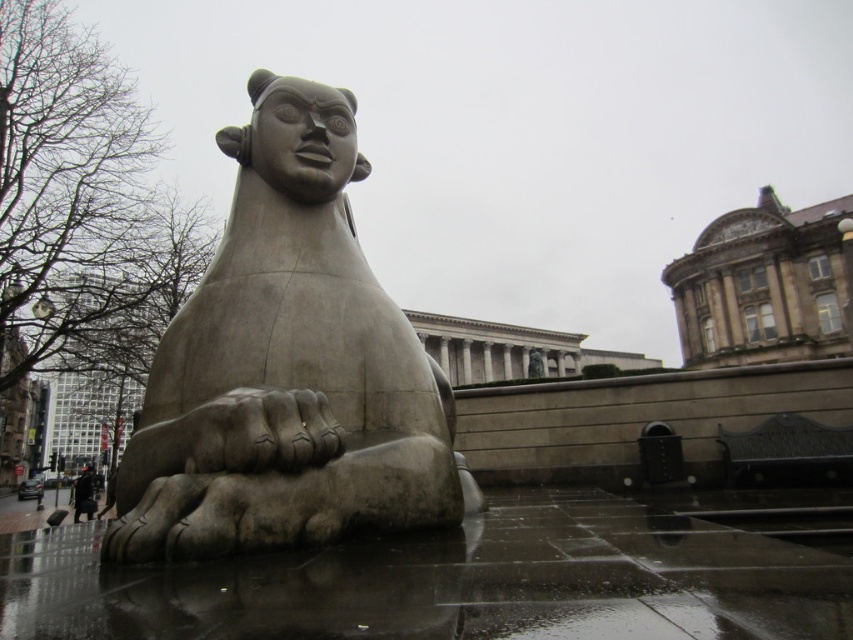
Question: Can you confirm if gray stone sculpture at center is positioned below dark brown leather coat at lower left?

Choices:
 (A) no
 (B) yes

Answer: (A)

Question: Is gray stone sculpture at center positioned in front of dark brown leather coat at lower left?

Choices:
 (A) yes
 (B) no

Answer: (A)

Question: Does gray stone sculpture at center have a lesser width compared to dark brown leather coat at lower left?

Choices:
 (A) yes
 (B) no

Answer: (A)

Question: Which point is farther to the camera?

Choices:
 (A) dark brown leather coat at lower left
 (B) gray stone sculpture at center

Answer: (A)

Question: Which object appears closest to the camera in this image?

Choices:
 (A) dark brown leather coat at lower left
 (B) gray stone sculpture at center

Answer: (B)